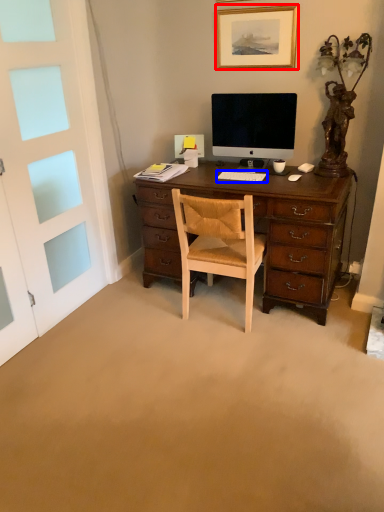
Question: Which point is further to the camera, picture frame (highlighted by a red box) or computer keyboard (highlighted by a blue box)?

Choices:
 (A) picture frame
 (B) computer keyboard

Answer: (B)